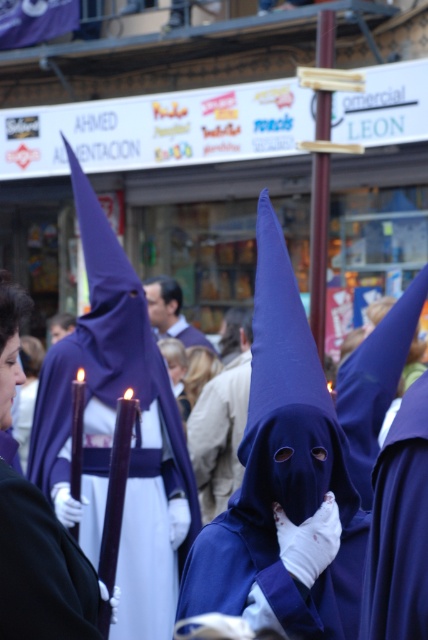
You are a photographer trying to capture the purple matte hood at center in the image. According to the coordinates provided, where exactly should you focus your camera lens to ensure the hood is in the center of your shot?

You should focus your camera lens at the coordinates point (282, 472) to ensure the purple matte hood at center is in the center of your shot.

You are an observer standing in the middle of the street during the procession. You notice two items at the center of the image, the purple matte cloth at center and the smooth beige coat at center. Which one is closer to you?

The purple matte cloth at center is closer to the viewer than the smooth beige coat at center.